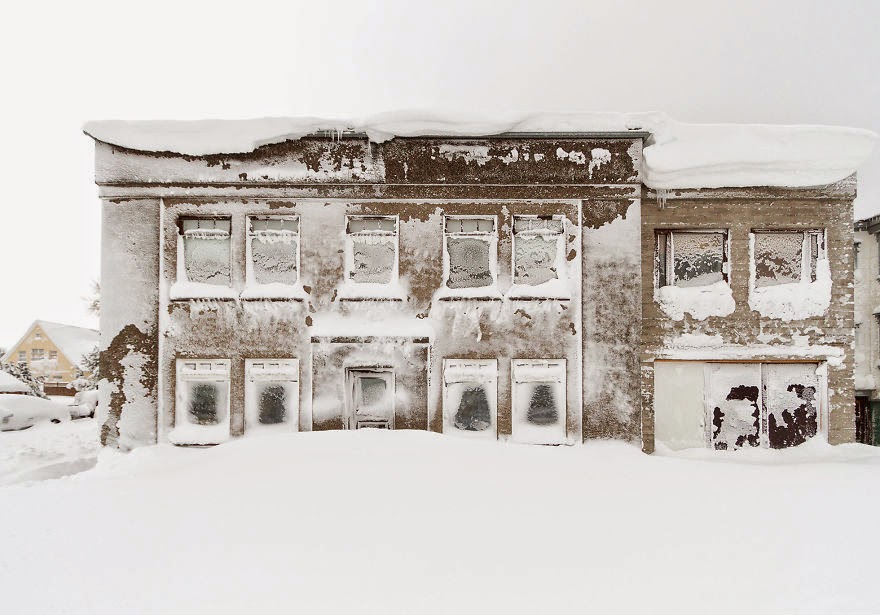
This screenshot has width=880, height=615. What are the coordinates of `door` in the screenshot? It's located at (367, 393).